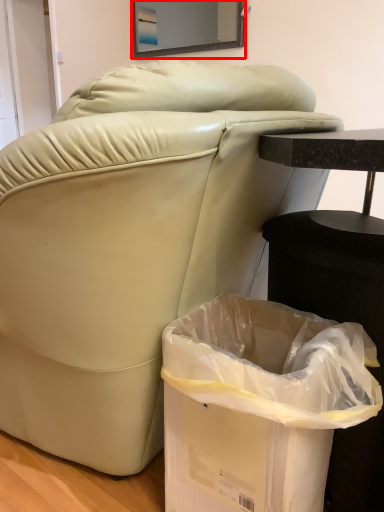
Question: Considering the relative positions of mirror (annotated by the red box) and trash bin/can in the image provided, where is mirror (annotated by the red box) located with respect to the staircase?

Choices:
 (A) right
 (B) left

Answer: (B)